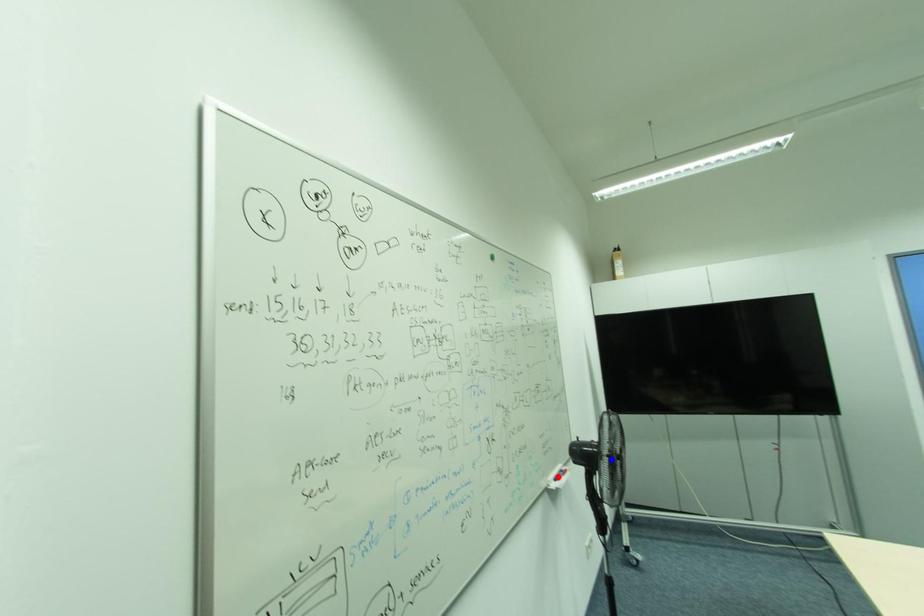
Question: In the image, two points are highlighted. Which point is nearer to the camera? Reply with the corresponding letter.

Choices:
 (A) blue point
 (B) red point

Answer: (A)